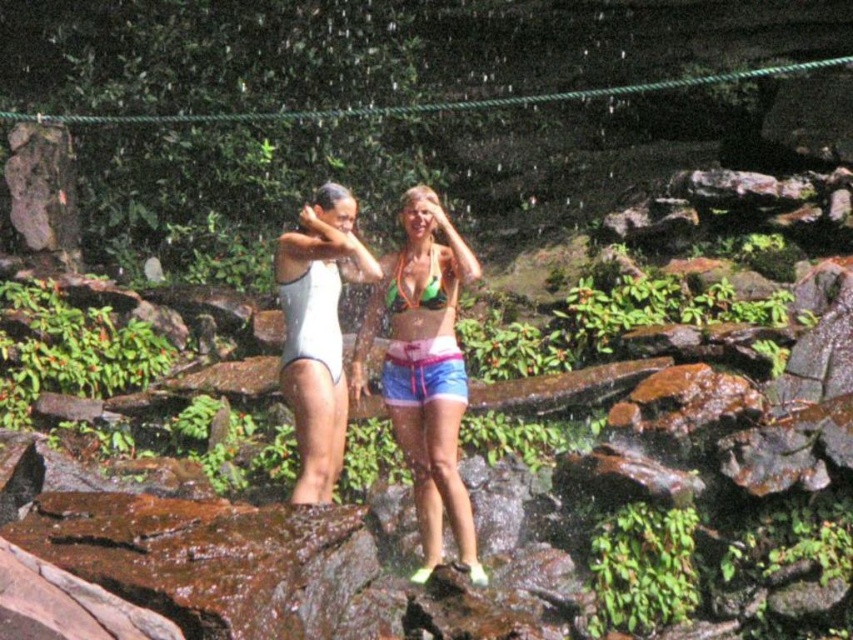
Is multicolored fabric shorts at center wider than green matte bikini top at center?

Yes, multicolored fabric shorts at center is wider than green matte bikini top at center.

What are the coordinates of `multicolored fabric shorts at center` in the screenshot? It's located at (422, 371).

The image size is (853, 640). Find the location of `multicolored fabric shorts at center`. multicolored fabric shorts at center is located at coordinates (422, 371).

Is point (451, 369) positioned before point (320, 196)?

Yes, point (451, 369) is in front of point (320, 196).

Which is in front, point (427, 221) or point (287, 268)?

Point (287, 268) is more forward.

Between point (398, 355) and point (287, 236), which one is positioned in front?

Positioned in front is point (287, 236).

You are a GUI agent. You are given a task and a screenshot of the screen. Output one action in this format:
    pyautogui.click(x=<x>, y=<y>)
    Task: Click on the neon green bikini top at center
    
    Given the screenshot: What is the action you would take?
    pyautogui.click(x=424, y=371)

Who is more forward, (389, 314) or (409, 355)?

Point (409, 355)

Is neon green bikini top at center behind multicolored fabric shorts at center?

No, it is in front of multicolored fabric shorts at center.

Describe the element at coordinates (424, 371) in the screenshot. This screenshot has height=640, width=853. I see `neon green bikini top at center` at that location.

Find the location of a particular element. The height and width of the screenshot is (640, 853). neon green bikini top at center is located at coordinates point(424,371).